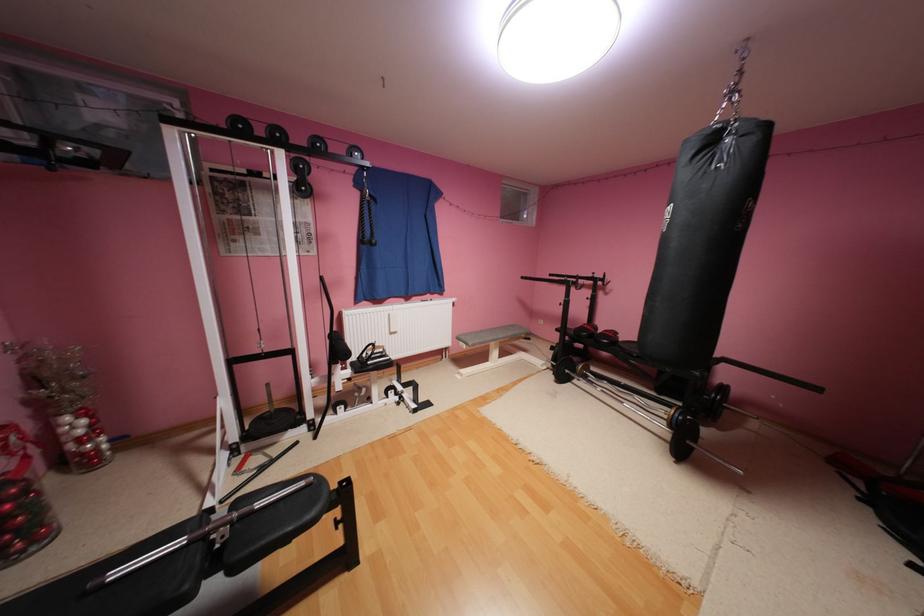
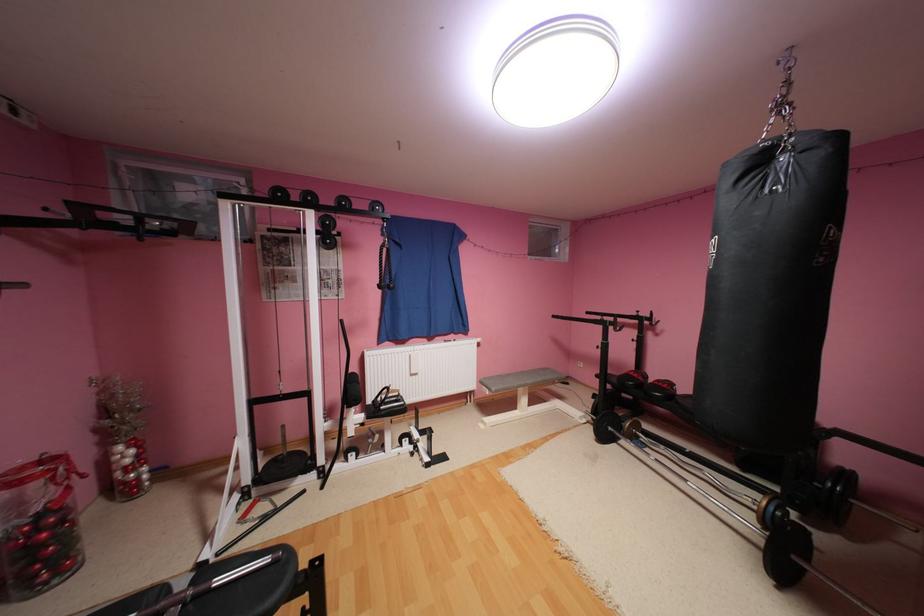
In the second image, find the point that corresponds to point 734,387 in the first image.

(857, 475)